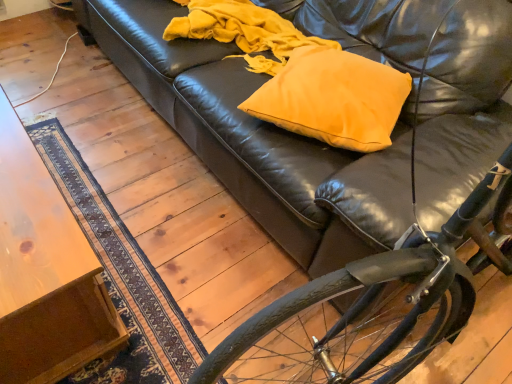
Question: Is matte yellow pillow at center smaller than wooden table at lower left?

Choices:
 (A) yes
 (B) no

Answer: (A)

Question: Can you confirm if matte yellow pillow at center is wider than wooden table at lower left?

Choices:
 (A) no
 (B) yes

Answer: (A)

Question: Is matte yellow pillow at center shorter than wooden table at lower left?

Choices:
 (A) no
 (B) yes

Answer: (B)

Question: Could you tell me if matte yellow pillow at center is facing wooden table at lower left?

Choices:
 (A) yes
 (B) no

Answer: (B)

Question: From the image's perspective, is matte yellow pillow at center on wooden table at lower left?

Choices:
 (A) no
 (B) yes

Answer: (B)

Question: Is matte yellow pillow at center at the left side of wooden table at lower left?

Choices:
 (A) no
 (B) yes

Answer: (A)

Question: Can you confirm if shiny black bicycle at lower right is positioned to the left of wooden table at lower left?

Choices:
 (A) no
 (B) yes

Answer: (A)

Question: Is shiny black bicycle at lower right positioned in front of wooden table at lower left?

Choices:
 (A) yes
 (B) no

Answer: (A)

Question: Are shiny black bicycle at lower right and wooden table at lower left located far from each other?

Choices:
 (A) yes
 (B) no

Answer: (B)

Question: Is shiny black bicycle at lower right directly adjacent to wooden table at lower left?

Choices:
 (A) yes
 (B) no

Answer: (B)

Question: Considering the relative sizes of shiny black bicycle at lower right and wooden table at lower left in the image provided, is shiny black bicycle at lower right bigger than wooden table at lower left?

Choices:
 (A) no
 (B) yes

Answer: (B)

Question: From a real-world perspective, is shiny black bicycle at lower right positioned under wooden table at lower left based on gravity?

Choices:
 (A) yes
 (B) no

Answer: (B)

Question: Can you confirm if matte yellow pillow at center is positioned to the left of shiny black bicycle at lower right?

Choices:
 (A) yes
 (B) no

Answer: (A)